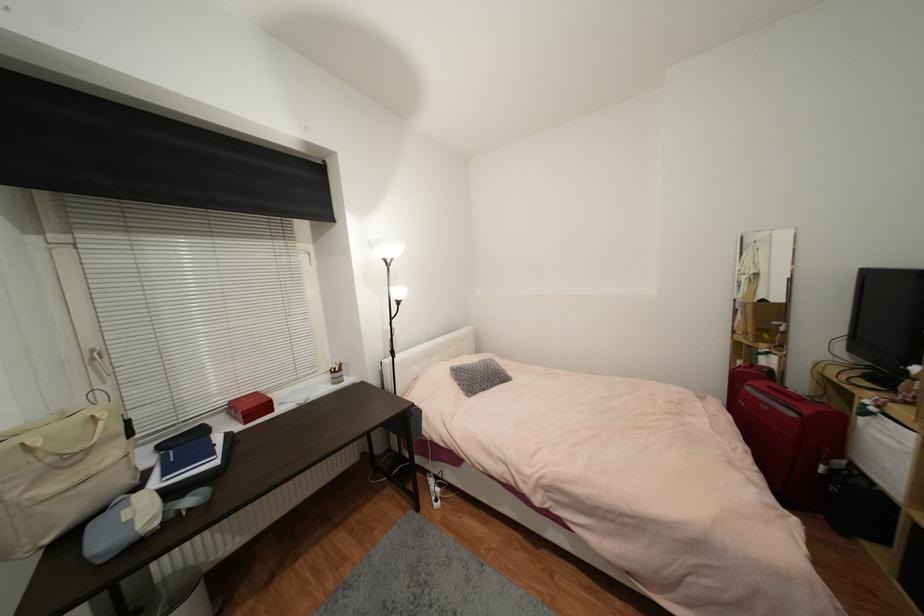
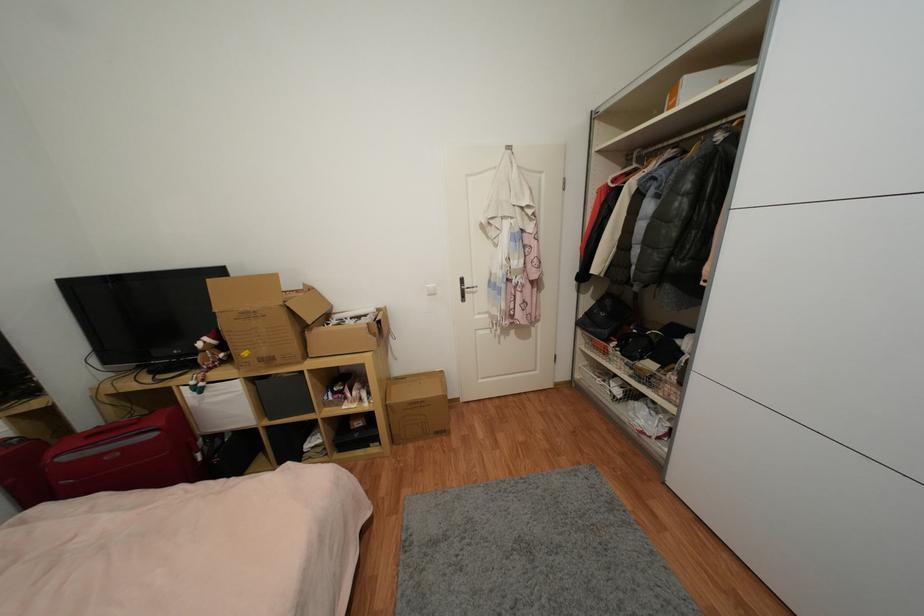
In the second image, find the point that corresponds to point (796, 416) in the first image.

(157, 436)